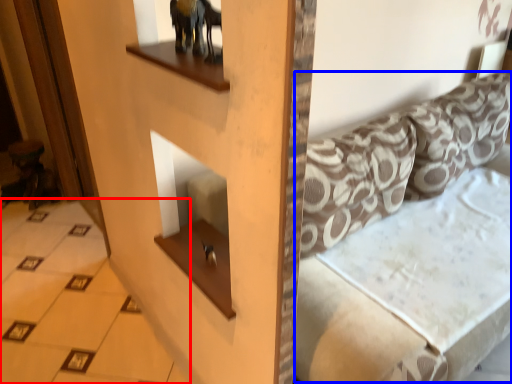
Question: Which object is closer to the camera taking this photo, tile (highlighted by a red box) or couch (highlighted by a blue box)?

Choices:
 (A) tile
 (B) couch

Answer: (B)